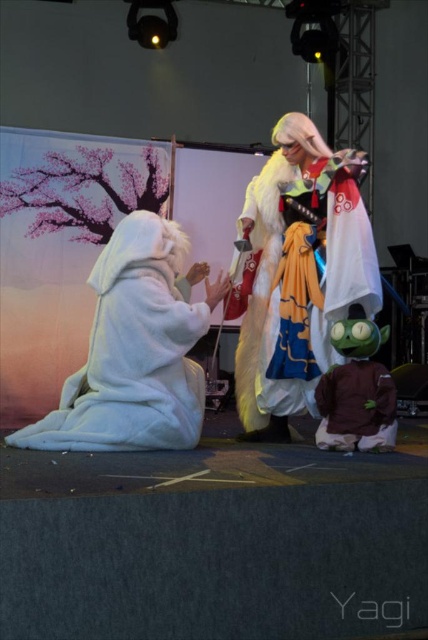
Question: Considering the real-world distances, which object is farthest from the brown plush toy at lower right?

Choices:
 (A) multicolored fabric costume at center
 (B) white fluffy robe at left

Answer: (B)

Question: Based on their relative distances, which object is farther from the brown plush toy at lower right?

Choices:
 (A) white fluffy robe at left
 (B) multicolored fabric costume at center

Answer: (A)

Question: Which point is closer to the camera?

Choices:
 (A) (193, 321)
 (B) (363, 280)
 (C) (383, 419)

Answer: (A)

Question: Does multicolored fabric costume at center appear over brown plush toy at lower right?

Choices:
 (A) yes
 (B) no

Answer: (A)

Question: Does white fluffy robe at left appear under brown plush toy at lower right?

Choices:
 (A) no
 (B) yes

Answer: (A)

Question: Can you confirm if multicolored fabric costume at center is bigger than brown plush toy at lower right?

Choices:
 (A) no
 (B) yes

Answer: (B)